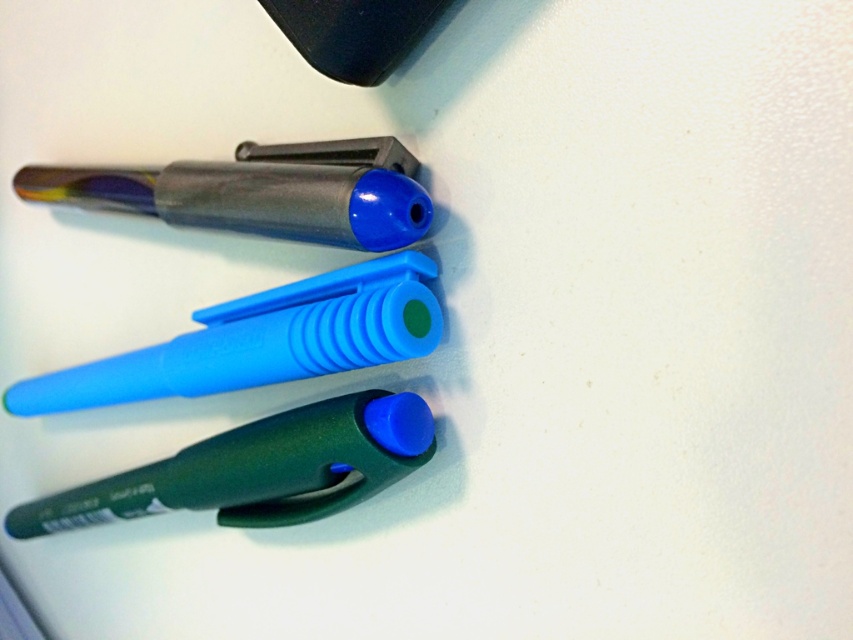
You are looking at the three pens arranged diagonally on the white surface. If you were to touch the point labeled point (x=187, y=394) and point (x=224, y=472), which one would feel closer to your hand?

Point (x=187, y=394) is further to the viewer than point (x=224, y=472), so touching point (x=187, y=394) would feel closer to your hand.

Based on the photo, you are organizing a desk and need to move the translucent blue pen at center and the green matte pen at lower center. Which pen would you need to move first to access the one behind it?

The translucent blue pen at center is in front of the green matte pen at lower center, so you need to move the translucent blue pen at center first to access the green matte pen at lower center.

You are organizing pens on a desk and see the point at coordinate (260,340). Which pen is located at that position?

The translucent blue pen at center is located at point (260,340).